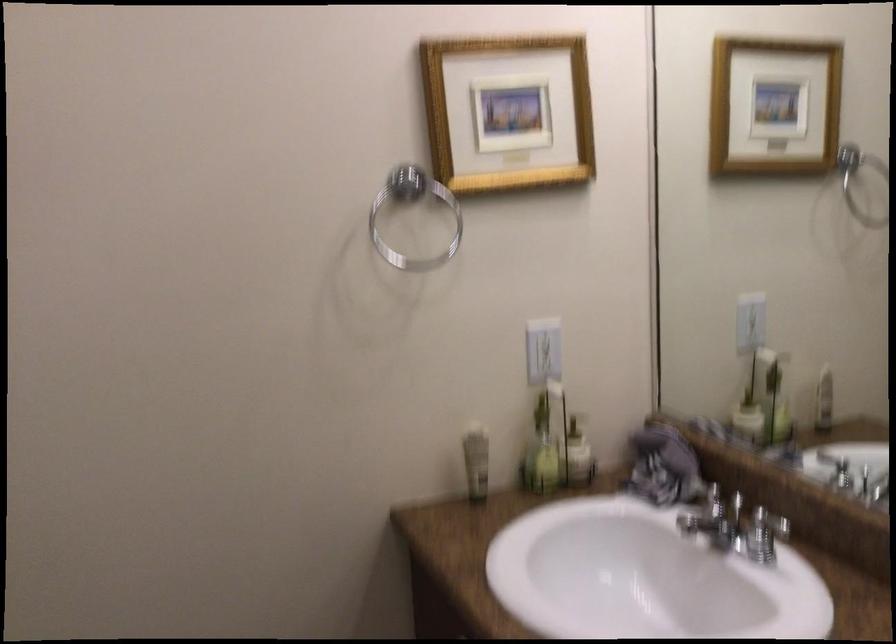
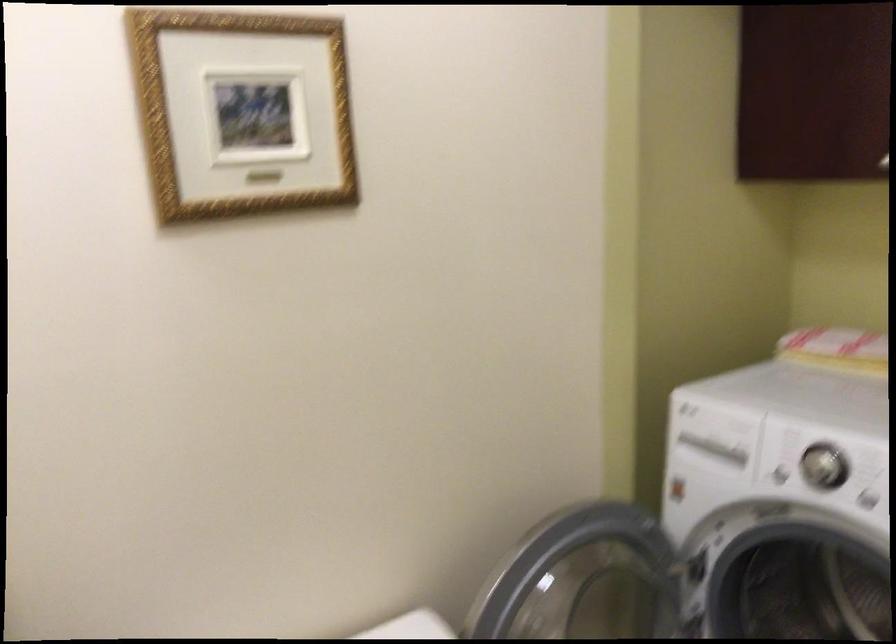
Question: The first image is from the beginning of the video and the second image is from the end. How did the camera likely rotate when shooting the video?

Choices:
 (A) Left
 (B) Right
 (C) Up
 (D) Down

Answer: (B)